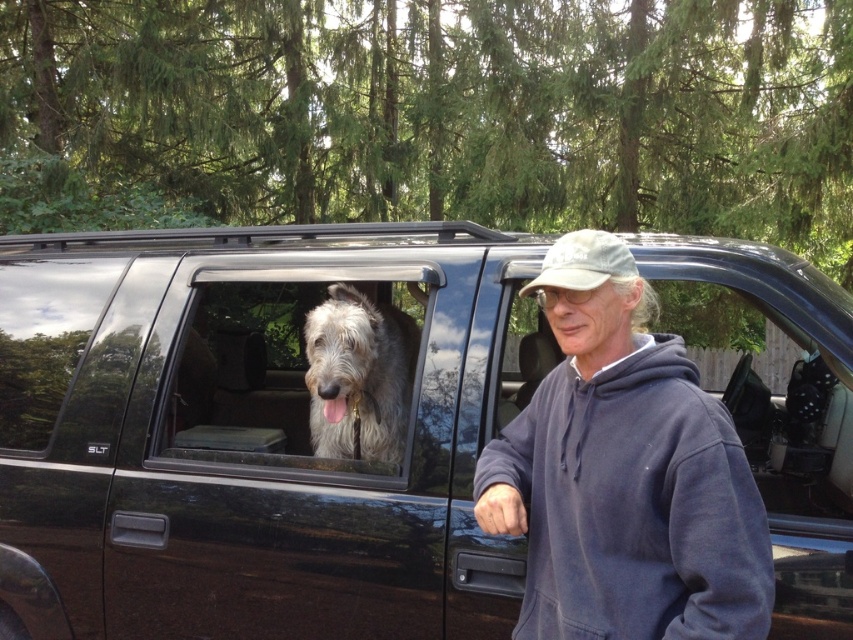
Which is more to the right, fuzzy gray dog at center or camouflage fabric baseball cap at center?

From the viewer's perspective, camouflage fabric baseball cap at center appears more on the right side.

Is fuzzy gray dog at center closer to camera compared to camouflage fabric baseball cap at center?

No, it is not.

Where is `fuzzy gray dog at center`? fuzzy gray dog at center is located at coordinates (358, 376).

Can you confirm if fuzzy fur dog at center is shorter than camouflage fabric baseball cap at center?

No.

Is fuzzy fur dog at center to the right of camouflage fabric baseball cap at center from the viewer's perspective?

In fact, fuzzy fur dog at center is to the left of camouflage fabric baseball cap at center.

Who is more forward, (384,342) or (607,232)?

Point (384,342) is more forward.

Where is `fuzzy fur dog at center`? fuzzy fur dog at center is located at coordinates (299, 369).

Who is shorter, glossy black suv at center or fuzzy fur dog at center?

glossy black suv at center

Which is in front, point (297, 342) or point (405, 269)?

Positioned in front is point (405, 269).

What are the coordinates of `glossy black suv at center` in the screenshot? It's located at (259, 429).